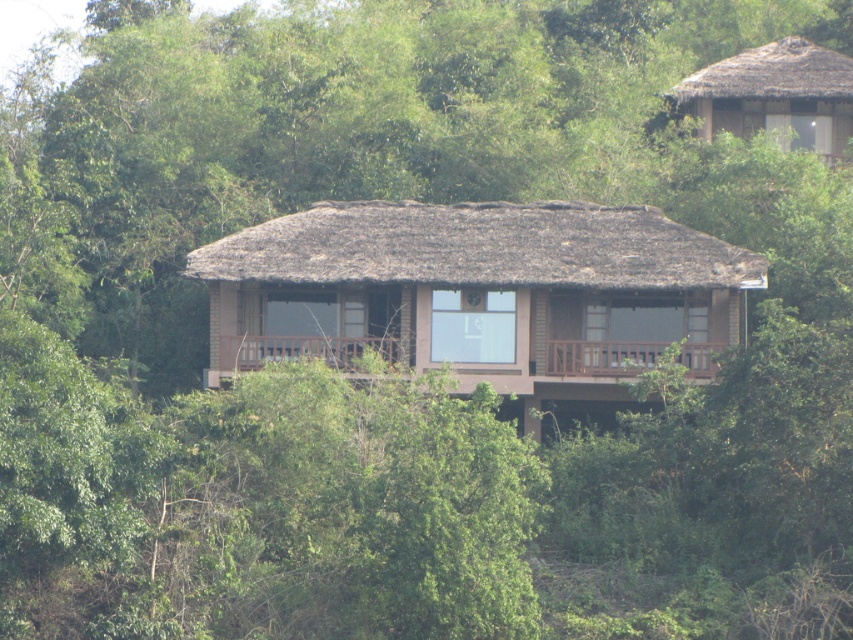
You are standing in front of the rustic building and want to enter the brown thatched roof hut at center. Which direction should you walk to get closer to it compared to the thatched straw hut at upper right?

You should walk forward towards the brown thatched roof hut at center because it is already closer to you than the thatched straw hut at upper right.

You are planning to install a solar panel on the highest point of the building. Based on the image, which structure should you choose between the brown thatched roof hut at center and the thatched straw hut at upper right?

The brown thatched roof hut at center has a greater height compared to the thatched straw hut at upper right, so you should install the solar panel on the brown thatched roof hut at center.